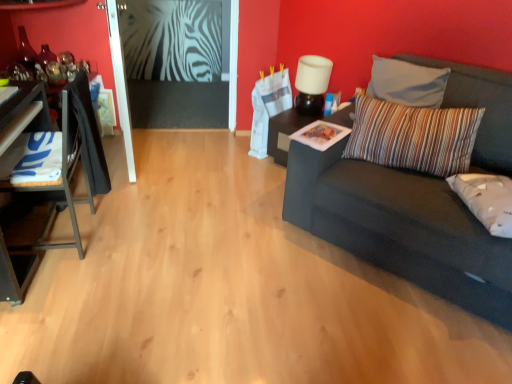
This screenshot has height=384, width=512. What do you see at coordinates (312, 84) in the screenshot?
I see `white matte lamp at upper center` at bounding box center [312, 84].

How much space does striped fabric pillow at right, arranged as the second pillow when ordered from the bottom, occupy horizontally?

striped fabric pillow at right, arranged as the second pillow when ordered from the bottom, is 10.32 inches in width.

You are a GUI agent. You are given a task and a screenshot of the screen. Output one action in this format:
    pyautogui.click(x=<x>, y=<y>)
    Task: Click on the white matte lamp at upper center
    Image resolution: width=512 pixels, height=384 pixels.
    Given the screenshot: What is the action you would take?
    pos(312,84)

Which of these two, black glossy table at center, which is the second table in left-to-right order, or dark gray fabric couch at right, is thinner?

With smaller width is black glossy table at center, which is the second table in left-to-right order.

From the image's perspective, is black glossy table at center, which is the second table in front-to-back order, located above or below dark gray fabric couch at right?

Clearly, from the image's perspective, black glossy table at center, which is the second table in front-to-back order, is above dark gray fabric couch at right.

Is black glossy table at center, which is the 1th table in back-to-front order, with dark gray fabric couch at right?

No, black glossy table at center, which is the 1th table in back-to-front order, is not making contact with dark gray fabric couch at right.

Considering the relative sizes of black glossy table at center, which is the first table from right to left, and dark gray fabric couch at right in the image provided, is black glossy table at center, which is the first table from right to left, shorter than dark gray fabric couch at right?

Yes.

From the picture: Is white fabric pillow at right, which is the first pillow in bottom-to-top order, bigger than black glossy table at center, which is the 1th table in back-to-front order?

Incorrect, white fabric pillow at right, which is the first pillow in bottom-to-top order, is not larger than black glossy table at center, which is the 1th table in back-to-front order.

Is black glossy table at center, which is the first table from right to left, a part of white fabric pillow at right, acting as the 2th pillow starting from the top?

No, black glossy table at center, which is the first table from right to left, is not inside white fabric pillow at right, acting as the 2th pillow starting from the top.

Measure the distance between white fabric pillow at right, acting as the 2th pillow starting from the top, and black glossy table at center, which is the first table from right to left.

white fabric pillow at right, acting as the 2th pillow starting from the top, is 4.33 feet from black glossy table at center, which is the first table from right to left.

Which is nearer, [510,183] or [312,118]?

The point [510,183] is in front.

Image resolution: width=512 pixels, height=384 pixels. Identify the location of table behind the white glossy table at left, which is counted as the 2th table, starting from the back. (297, 129).

From the image's perspective, is white glossy table at left, which is counted as the 2th table, starting from the back, above or below black glossy table at center, which is the second table in front-to-back order?

Based on their image positions, white glossy table at left, which is counted as the 2th table, starting from the back, is located beneath black glossy table at center, which is the second table in front-to-back order.

Based on their positions, is white glossy table at left, the 2th table positioned from the right, located to the left or right of black glossy table at center, which is the first table from right to left?

white glossy table at left, the 2th table positioned from the right, is positioned on black glossy table at center, which is the first table from right to left,'s left side.

Is white glossy table at left, the 2th table positioned from the right, facing towards black glossy table at center, which is the second table in front-to-back order?

Yes, white glossy table at left, the 2th table positioned from the right, is aimed at black glossy table at center, which is the second table in front-to-back order.

In the scene shown: Does black glossy table at center, which is the second table in left-to-right order, touch white matte lamp at upper center?

black glossy table at center, which is the second table in left-to-right order, and white matte lamp at upper center are clearly separated.

From the image's perspective, is black glossy table at center, which is the 1th table in back-to-front order, over white matte lamp at upper center?

No, from the image's perspective, black glossy table at center, which is the 1th table in back-to-front order, is not over white matte lamp at upper center.

How different are the orientations of black glossy table at center, which is the second table in left-to-right order, and white matte lamp at upper center in degrees?

black glossy table at center, which is the second table in left-to-right order, and white matte lamp at upper center are facing 3.29 degrees away from each other.

In the image, is black glossy table at center, which is the second table in left-to-right order, positioned in front of or behind white matte lamp at upper center?

black glossy table at center, which is the second table in left-to-right order, is positioned farther from the viewer than white matte lamp at upper center.

Is white matte lamp at upper center positioned far away from white glossy table at left, positioned as the first table in left-to-right order?

white matte lamp at upper center is far away from white glossy table at left, positioned as the first table in left-to-right order.

Does white matte lamp at upper center have a greater height compared to white glossy table at left, the 2th table positioned from the right?

In fact, white matte lamp at upper center may be shorter than white glossy table at left, the 2th table positioned from the right.

Is white matte lamp at upper center at the right side of white glossy table at left, the first table from the front?

Correct, you'll find white matte lamp at upper center to the right of white glossy table at left, the first table from the front.

Who is taller, striped fabric pillow at right, acting as the first pillow starting from the top, or white fabric pillow at right, which is the first pillow in bottom-to-top order?

striped fabric pillow at right, acting as the first pillow starting from the top, is taller.

Does point (466, 125) appear closer or farther from the camera than point (474, 188)?

Point (466, 125) is positioned farther from the camera compared to point (474, 188).

Considering the relative positions of striped fabric pillow at right, acting as the first pillow starting from the top, and white fabric pillow at right, which is the first pillow in bottom-to-top order, in the image provided, is striped fabric pillow at right, acting as the first pillow starting from the top, to the left or to the right of white fabric pillow at right, which is the first pillow in bottom-to-top order,?

striped fabric pillow at right, acting as the first pillow starting from the top, is to the left of white fabric pillow at right, which is the first pillow in bottom-to-top order.

From the image's perspective, is striped fabric pillow at right, acting as the first pillow starting from the top, on black glossy table at center, which is the second table in front-to-back order?

No.

Can you confirm if striped fabric pillow at right, acting as the first pillow starting from the top, is wider than black glossy table at center, which is the 1th table in back-to-front order?

No, striped fabric pillow at right, acting as the first pillow starting from the top, is not wider than black glossy table at center, which is the 1th table in back-to-front order.

Which of these two, striped fabric pillow at right, acting as the first pillow starting from the top, or black glossy table at center, which is the 1th table in back-to-front order, stands shorter?

striped fabric pillow at right, acting as the first pillow starting from the top, is shorter.

This screenshot has width=512, height=384. What are the coordinates of `studio couch in front of the black glossy table at center, which is the second table in left-to-right order` in the screenshot? It's located at (401, 227).

You are a GUI agent. You are given a task and a screenshot of the screen. Output one action in this format:
    pyautogui.click(x=<x>, y=<y>)
    Task: Click on the table that is the 1st object to the left of the white fabric pillow at right, acting as the 2th pillow starting from the top, starting at the anchor
    The height and width of the screenshot is (384, 512).
    Given the screenshot: What is the action you would take?
    pyautogui.click(x=297, y=129)

When comparing their distances from dark gray fabric couch at right, does striped fabric pillow at right, arranged as the second pillow when ordered from the bottom, or white fabric pillow at right, which is the first pillow in bottom-to-top order, seem further?

white fabric pillow at right, which is the first pillow in bottom-to-top order, lies further to dark gray fabric couch at right than the other object.

From the image, which object appears to be farther from dark gray fabric couch at right, black glossy table at center, which is the second table in front-to-back order, or white glossy table at left, the 2th table positioned from the right?

The object further to dark gray fabric couch at right is white glossy table at left, the 2th table positioned from the right.

Considering their positions, is white matte lamp at upper center positioned further to striped fabric pillow at right, arranged as the second pillow when ordered from the bottom, than white fabric pillow at right, which is the first pillow in bottom-to-top order?

Among the two, white matte lamp at upper center is located further to striped fabric pillow at right, arranged as the second pillow when ordered from the bottom.

Estimate the real-world distances between objects in this image. Which object is closer to black glossy table at center, which is the first table from right to left, white fabric pillow at right, which is the first pillow in bottom-to-top order, or white glossy table at left, which is counted as the 2th table, starting from the back?

The object closer to black glossy table at center, which is the first table from right to left, is white fabric pillow at right, which is the first pillow in bottom-to-top order.

Looking at the image, which one is located closer to white matte lamp at upper center, dark gray fabric couch at right or white glossy table at left, the 2th table positioned from the right?

dark gray fabric couch at right is closer to white matte lamp at upper center.

From the image, which object appears to be farther from white glossy table at left, the 2th table positioned from the right, striped fabric pillow at right, arranged as the second pillow when ordered from the bottom, or white matte lamp at upper center?

white matte lamp at upper center lies further to white glossy table at left, the 2th table positioned from the right, than the other object.

Looking at the image, which one is located closer to black glossy table at center, which is the second table in left-to-right order, white matte lamp at upper center or white glossy table at left, positioned as the first table in left-to-right order?

The object closer to black glossy table at center, which is the second table in left-to-right order, is white matte lamp at upper center.

Considering their positions, is white glossy table at left, which is counted as the 2th table, starting from the back, positioned closer to striped fabric pillow at right, acting as the first pillow starting from the top, than white fabric pillow at right, acting as the 2th pillow starting from the top?

white fabric pillow at right, acting as the 2th pillow starting from the top.

Locate an element on the screen. The height and width of the screenshot is (384, 512). pillow between dark gray fabric couch at right and striped fabric pillow at right, acting as the first pillow starting from the top, from front to back is located at coordinates (486, 200).

The image size is (512, 384). In order to click on pillow between white glossy table at left, the first table from the front, and white fabric pillow at right, acting as the 2th pillow starting from the top, from left to right in this screenshot , I will do `click(413, 136)`.

The height and width of the screenshot is (384, 512). Find the location of `table between white glossy table at left, positioned as the first table in left-to-right order, and striped fabric pillow at right, arranged as the second pillow when ordered from the bottom, from left to right`. table between white glossy table at left, positioned as the first table in left-to-right order, and striped fabric pillow at right, arranged as the second pillow when ordered from the bottom, from left to right is located at coordinates (297, 129).

You are a GUI agent. You are given a task and a screenshot of the screen. Output one action in this format:
    pyautogui.click(x=<x>, y=<y>)
    Task: Click on the table between white glossy table at left, which is counted as the 2th table, starting from the back, and white fabric pillow at right, which is the first pillow in bottom-to-top order, in the horizontal direction
    Image resolution: width=512 pixels, height=384 pixels.
    Given the screenshot: What is the action you would take?
    pyautogui.click(x=297, y=129)